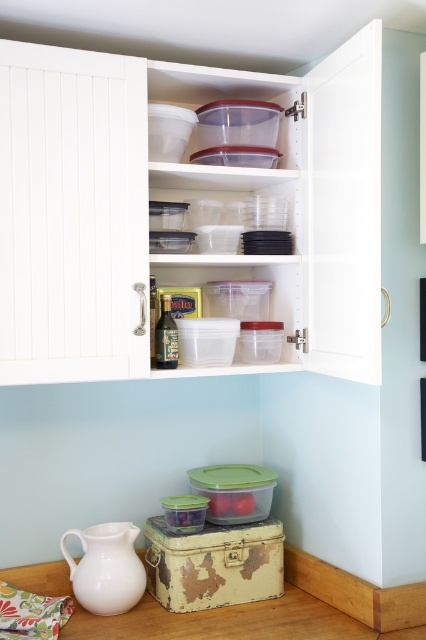
You are trying to decide whether to place a new rectangular object between the clear plastic containers at upper center and the white matte jug at lower left. Based on their widths, can the object fit if it is as wide as the wider of the two?

The clear plastic containers at upper center might be wider than white matte jug at lower left, so the object should be placed where the wider item is located to ensure it fits.

You need to store a large casserole dish in the kitchen. Which object, the clear plastic containers at upper center or the white matte jug at lower left, is more suitable for storing the dish based on their sizes?

The clear plastic containers at upper center has a larger size compared to the white matte jug at lower left, so the clear plastic containers at upper center is more suitable for storing the large casserole dish.